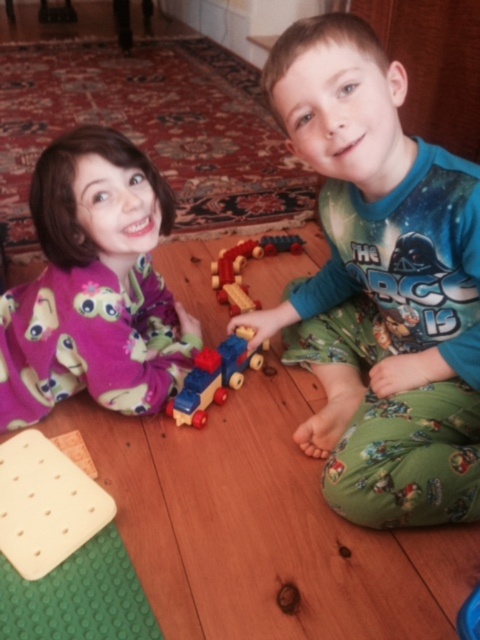
In the scene shown: You are a parent trying to take a photo of the wooden train at center. The green cotton pajamas at center are blocking your view. Can you move the pajamas to get a clear shot of the train?

The green cotton pajamas at center is in front of the wooden train at center, so moving the pajamas would allow you to see the train clearly.

You are standing in the room where the two children are playing with the toy train set. You want to pick up the toy train set located at point (91, 172). If your hand is 0.5 meters away from the point, can you reach it?

The point (91, 172) is 1.09 meters from the viewer. Since your hand is 0.5 meters away from the point, the total distance from you to the toy train set is 1.09 meters minus 0.5 meters, which equals 0.59 meters. Therefore, you can easily reach it.